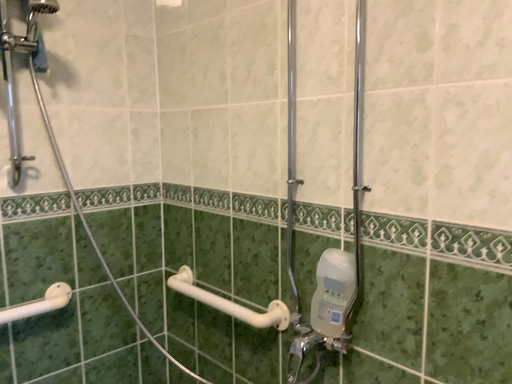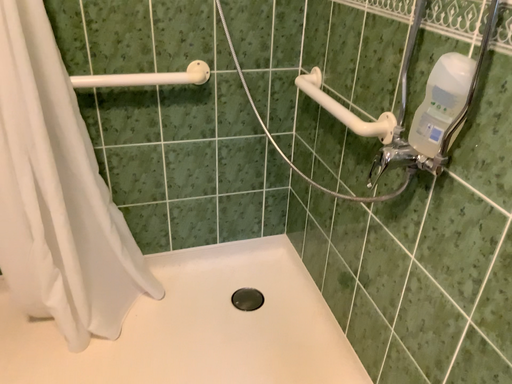
Question: How did the camera likely rotate when shooting the video?

Choices:
 (A) rotated right
 (B) rotated left

Answer: (B)